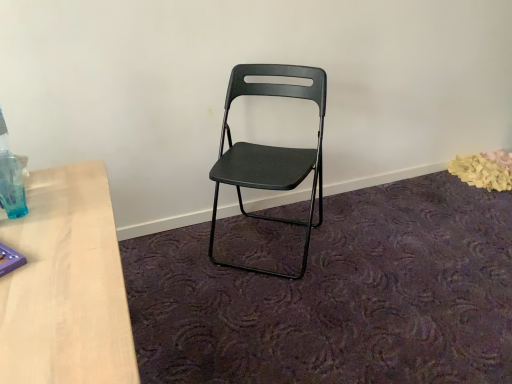
What are the coordinates of `vacant space positioned to the left of matte black folding chair at center` in the screenshot? It's located at (172, 258).